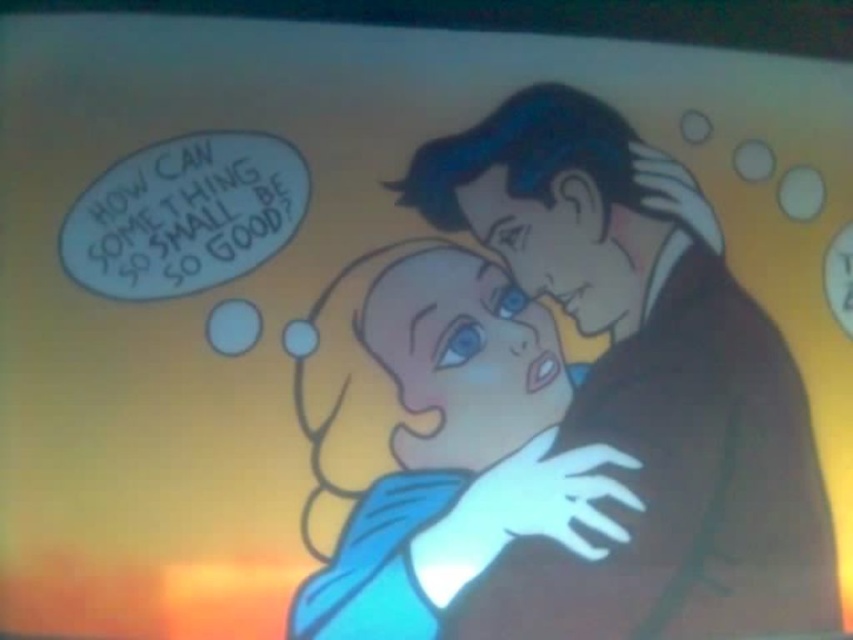
Question: Among these objects, which one is farthest from the camera?

Choices:
 (A) blue fabric baby at center
 (B) smooth brown suit at center

Answer: (B)

Question: Is smooth brown suit at center positioned behind blue fabric baby at center?

Choices:
 (A) yes
 (B) no

Answer: (A)

Question: Which object appears closest to the camera in this image?

Choices:
 (A) blue fabric baby at center
 (B) smooth brown suit at center

Answer: (A)

Question: Is smooth brown suit at center wider than blue fabric baby at center?

Choices:
 (A) yes
 (B) no

Answer: (A)

Question: Which of the following is the closest to the observer?

Choices:
 (A) smooth brown suit at center
 (B) blue fabric baby at center

Answer: (B)

Question: Does smooth brown suit at center come in front of blue fabric baby at center?

Choices:
 (A) yes
 (B) no

Answer: (B)